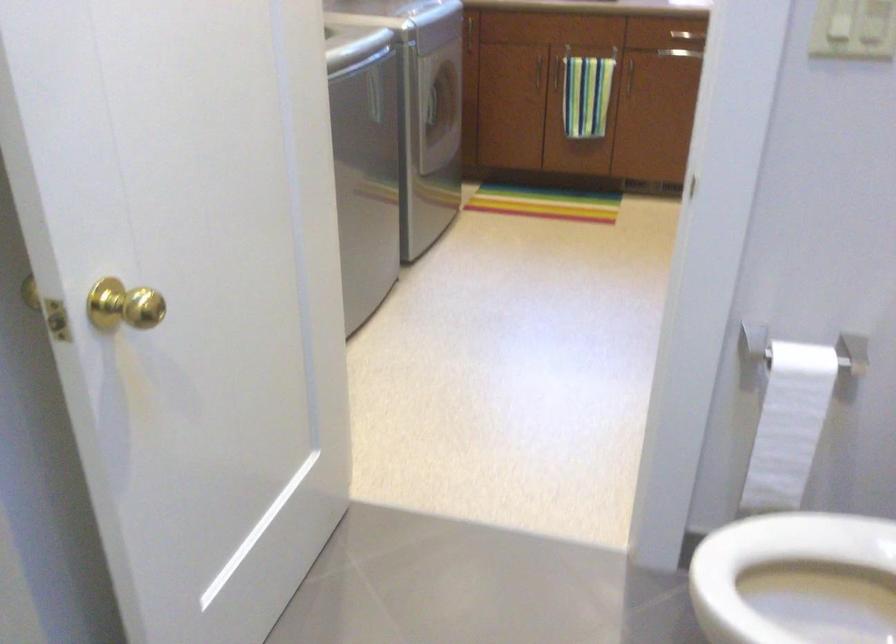
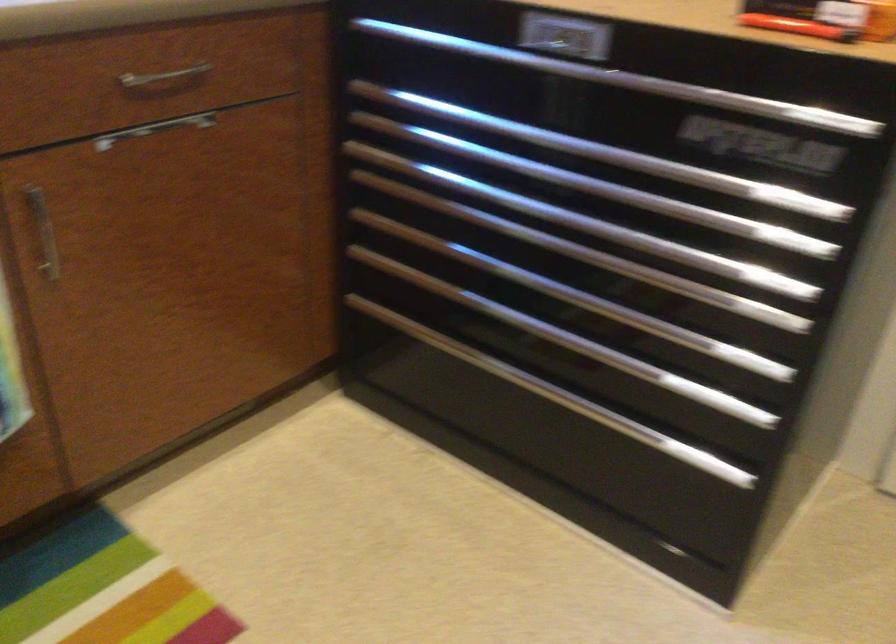
Locate, in the second image, the point that corresponds to (631,75) in the first image.

(42, 232)